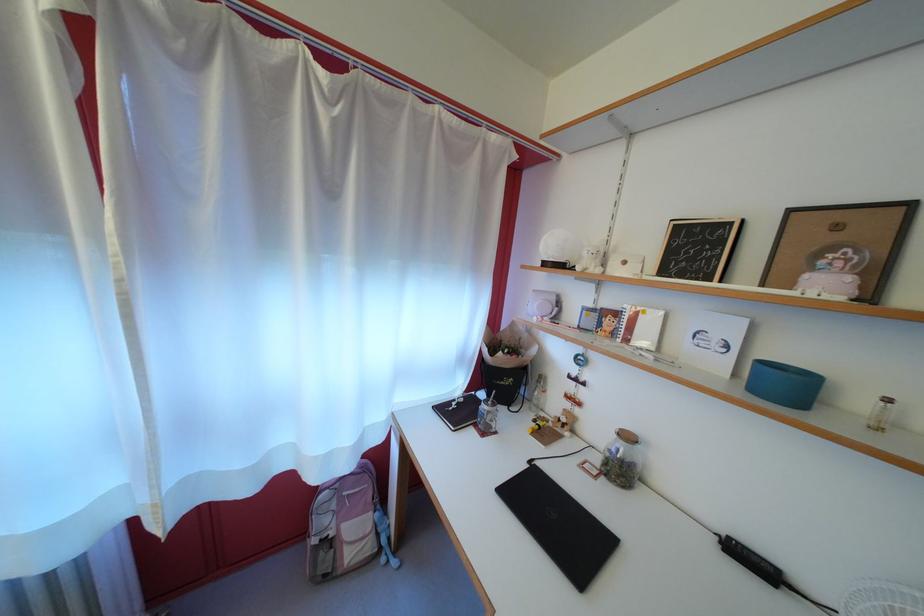
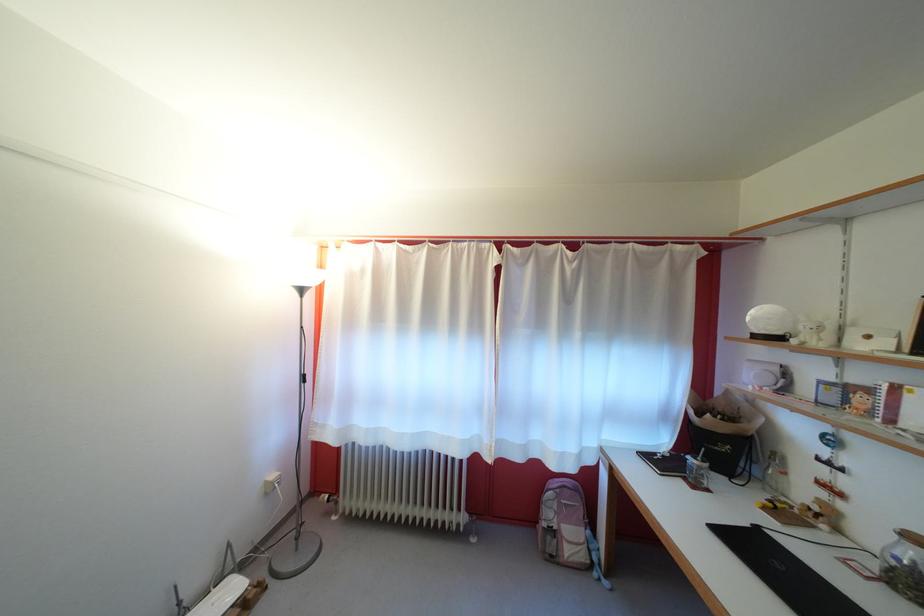
Question: How did the camera likely rotate?

Choices:
 (A) Left
 (B) Right
 (C) Up
 (D) Down

Answer: (A)